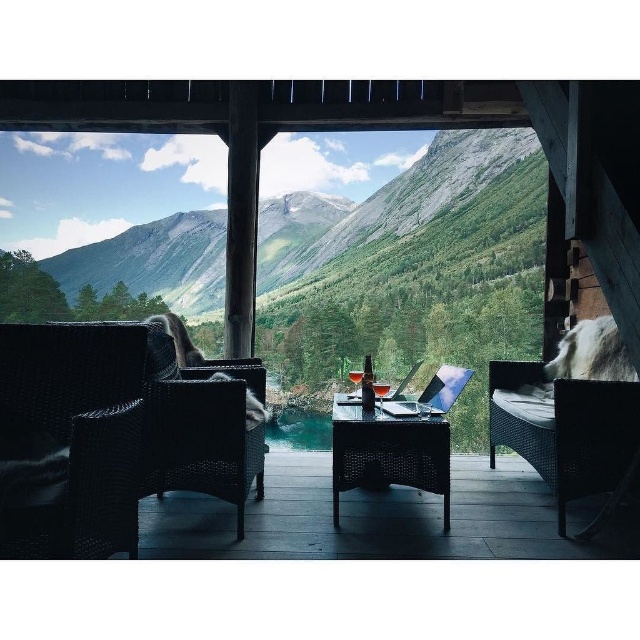
From the picture: You are planning to host a small gathering and need to seat two people comfortably. Given the space between the two chairs, can both the woven dark brown armchair at left and the woven rattan armchair at left fit side by side without overlapping?

The woven dark brown armchair at left is wider than the woven rattan armchair at left. Since the question mentions the space between the chairs, but the description only provides information about their widths, we cannot determine if they can fit side by side without knowing the available space. More information about the distance between the chairs is needed to answer this accurately.

You are standing on the balcony and want to place a small plant between the two points, point [547,468] and point [432,467]. Which point should the plant be closer to if you want it to be nearer to the mountains in the background?

The plant should be placed closer to point [432,467] because it is closer to the mountains in the background compared to point [547,468], which is further away.